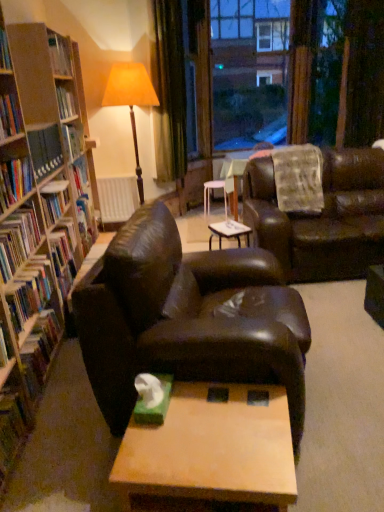
Question: From the image's perspective, is white matte radiator at center below leather couch at center, which is counted as the second studio couch, starting from the front?

Choices:
 (A) no
 (B) yes

Answer: (A)

Question: From the image's perspective, is white matte radiator at center above leather couch at center, arranged as the 1th studio couch when viewed from the right?

Choices:
 (A) no
 (B) yes

Answer: (B)

Question: Is white matte radiator at center bigger than leather couch at center, which is counted as the second studio couch, starting from the front?

Choices:
 (A) no
 (B) yes

Answer: (A)

Question: Is white matte radiator at center to the right of leather couch at center, the first studio couch when ordered from back to front, from the viewer's perspective?

Choices:
 (A) yes
 (B) no

Answer: (B)

Question: Is leather couch at center, the first studio couch when ordered from back to front, completely or partially inside white matte radiator at center?

Choices:
 (A) no
 (B) yes

Answer: (A)

Question: From the image's perspective, is hardcover book at left, which appears as the 3th book when ordered from the bottom, located above or below hardcover book at left, the fifth book when ordered from bottom to top?

Choices:
 (A) below
 (B) above

Answer: (A)

Question: Considering the positions of point (39, 281) and point (0, 162), is point (39, 281) closer or farther from the camera than point (0, 162)?

Choices:
 (A) farther
 (B) closer

Answer: (A)

Question: Is hardcover book at left, which is the fifth book in top-to-bottom order, bigger or smaller than hardcover book at left, the fifth book when ordered from bottom to top?

Choices:
 (A) big
 (B) small

Answer: (A)

Question: Is hardcover book at left, which appears as the 3th book when ordered from the bottom, to the left or to the right of hardcover book at left, the third book from the top, in the image?

Choices:
 (A) right
 (B) left

Answer: (A)

Question: Is green velvet curtain at upper center in front of or behind shiny brown leather couch at center, which is the 2th studio couch from back to front, in the image?

Choices:
 (A) front
 (B) behind

Answer: (B)

Question: Is green velvet curtain at upper center situated inside shiny brown leather couch at center, acting as the 1th studio couch starting from the front, or outside?

Choices:
 (A) inside
 (B) outside

Answer: (B)

Question: From the image's perspective, relative to shiny brown leather couch at center, the 2th studio couch from the right, is green velvet curtain at upper center above or below?

Choices:
 (A) below
 (B) above

Answer: (B)

Question: Is green velvet curtain at upper center bigger or smaller than shiny brown leather couch at center, the 2th studio couch from the right?

Choices:
 (A) big
 (B) small

Answer: (B)

Question: Considering the positions of hardcover book at left, which ranks as the 2th book in top-to-bottom order, and leather couch at center, the first studio couch when ordered from back to front, in the image, is hardcover book at left, which ranks as the 2th book in top-to-bottom order, bigger or smaller than leather couch at center, the first studio couch when ordered from back to front,?

Choices:
 (A) small
 (B) big

Answer: (A)

Question: From the image's perspective, relative to leather couch at center, placed as the second studio couch when sorted from left to right, is hardcover book at left, the 6th book in the bottom-to-top sequence, above or below?

Choices:
 (A) above
 (B) below

Answer: (A)